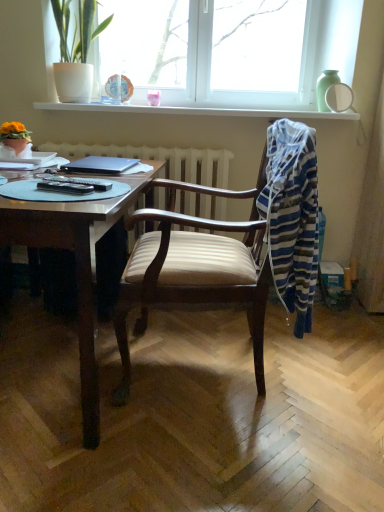
Question: Does matte orange flower pot at left, positioned as the first houseplant in front-to-back order, have a greater height compared to striped cotton laundry at right?

Choices:
 (A) no
 (B) yes

Answer: (A)

Question: From the image's perspective, is matte orange flower pot at left, which is the first houseplant in left-to-right order, on top of striped cotton laundry at right?

Choices:
 (A) no
 (B) yes

Answer: (B)

Question: Considering the relative positions of matte orange flower pot at left, which is the second houseplant from back to front, and striped cotton laundry at right in the image provided, is matte orange flower pot at left, which is the second houseplant from back to front, to the right of striped cotton laundry at right from the viewer's perspective?

Choices:
 (A) yes
 (B) no

Answer: (B)

Question: Could you tell me if matte orange flower pot at left, which is the first houseplant in left-to-right order, is facing striped cotton laundry at right?

Choices:
 (A) no
 (B) yes

Answer: (A)

Question: From a real-world perspective, is matte orange flower pot at left, which ranks as the 2th houseplant in right-to-left order, located beneath striped cotton laundry at right?

Choices:
 (A) no
 (B) yes

Answer: (A)

Question: From their relative heights in the image, would you say white glossy window sill at upper center is taller or shorter than white plastic window at upper center?

Choices:
 (A) short
 (B) tall

Answer: (A)

Question: Considering the relative positions of white glossy window sill at upper center and white plastic window at upper center in the image provided, is white glossy window sill at upper center to the left or to the right of white plastic window at upper center?

Choices:
 (A) right
 (B) left

Answer: (B)

Question: From the image's perspective, is white glossy window sill at upper center above or below white plastic window at upper center?

Choices:
 (A) above
 (B) below

Answer: (B)

Question: Looking at their shapes, would you say white glossy window sill at upper center is wider or thinner than white plastic window at upper center?

Choices:
 (A) thin
 (B) wide

Answer: (B)

Question: Considering the positions of white glossy window sill at upper center and wooden desk at left in the image, is white glossy window sill at upper center bigger or smaller than wooden desk at left?

Choices:
 (A) small
 (B) big

Answer: (A)

Question: From a real-world perspective, relative to wooden desk at left, is white glossy window sill at upper center vertically above or below?

Choices:
 (A) below
 (B) above

Answer: (B)

Question: From their relative heights in the image, would you say white glossy window sill at upper center is taller or shorter than wooden desk at left?

Choices:
 (A) short
 (B) tall

Answer: (A)

Question: Based on their positions, is white glossy window sill at upper center located to the left or right of wooden desk at left?

Choices:
 (A) left
 (B) right

Answer: (B)

Question: From the image's perspective, is white glossy window sill at upper center positioned above or below striped cotton laundry at right?

Choices:
 (A) below
 (B) above

Answer: (B)

Question: Which is correct: white glossy window sill at upper center is inside striped cotton laundry at right, or outside of it?

Choices:
 (A) inside
 (B) outside

Answer: (B)